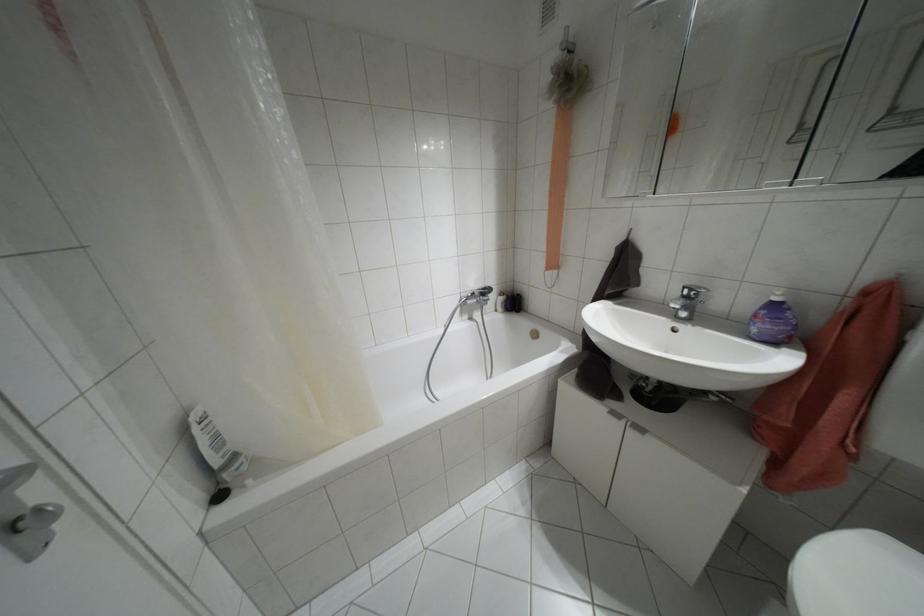
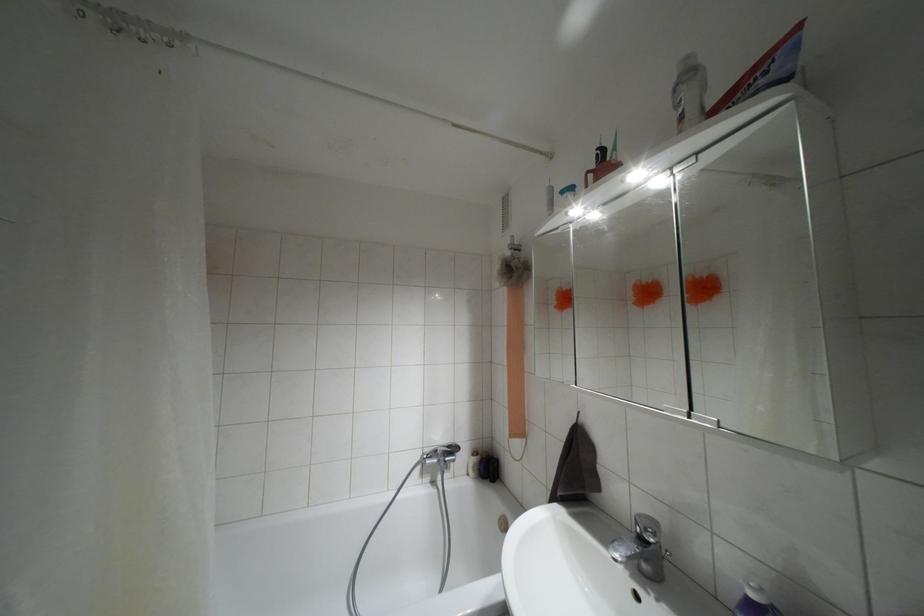
In the second image, find the point that corresponds to the point at 482,288 in the first image.

(447, 446)